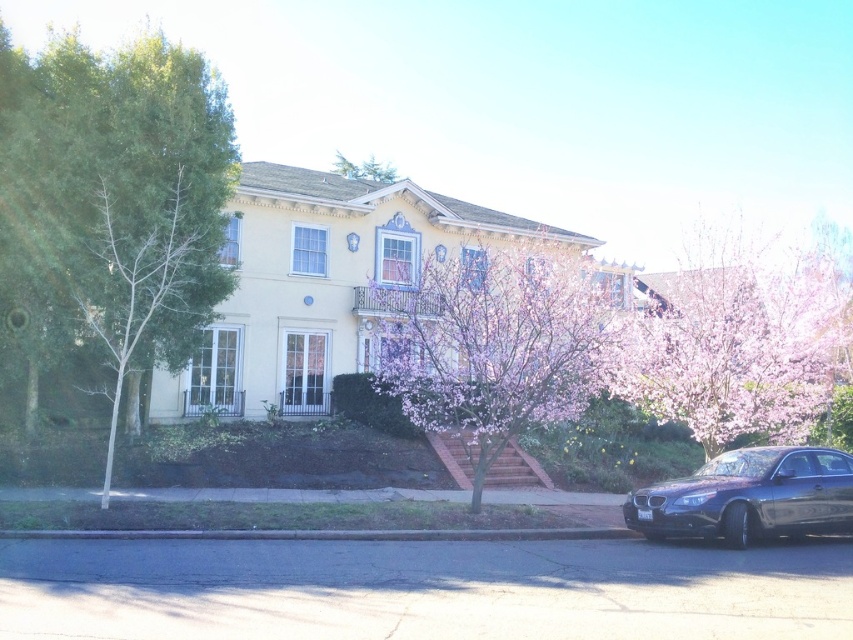
In the scene shown: You are a visitor arriving at the house and notice the glossy black car at lower right and the pink blossoming tree at right. From your vantage point, which object is closer to you?

The pink blossoming tree at right is closer to you because the glossy black car at lower right is behind it.

You are a landscape architect designing a garden path between the pink blossoming tree at right and the green matte tree at upper center. Considering their sizes, which tree should you place closer to the entrance to ensure the path remains wide enough for visitors?

The pink blossoming tree at right is bigger than the green matte tree at upper center, so placing the smaller green matte tree at upper center closer to the entrance would allow the path to be wider near the entrance, ensuring easier access for visitors.